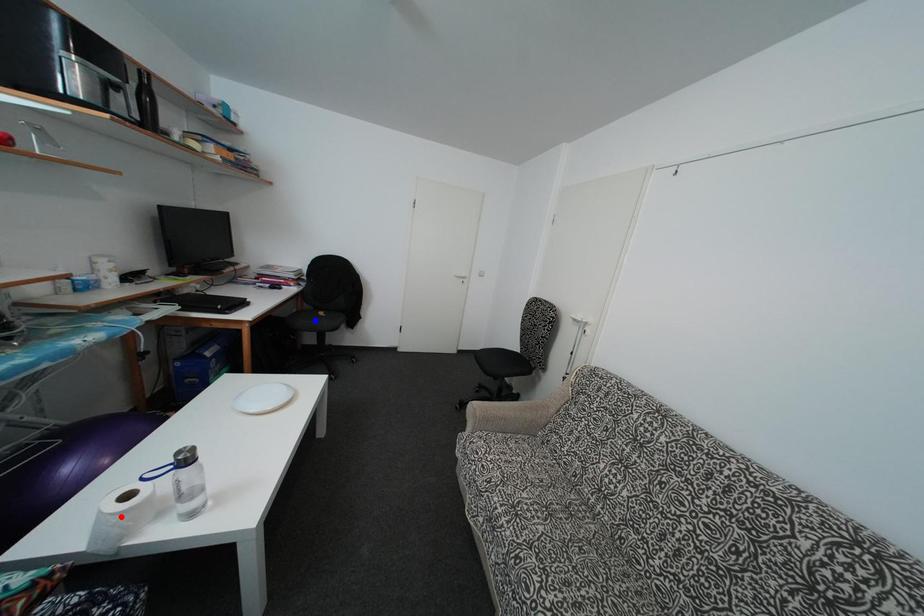
Question: In the image, two points are highlighted. Which point is nearer to the camera? Reply with the corresponding letter.

Choices:
 (A) blue point
 (B) red point

Answer: (B)